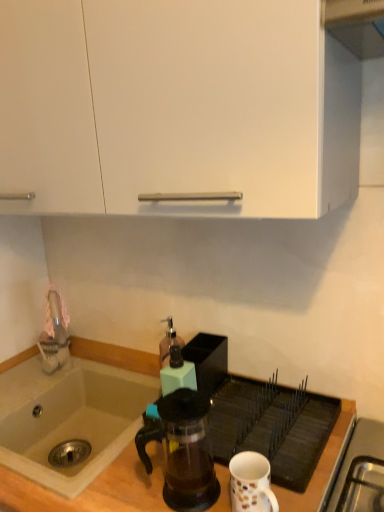
The width and height of the screenshot is (384, 512). I want to click on vacant space behind white ceramic mug at lower right, so click(258, 444).